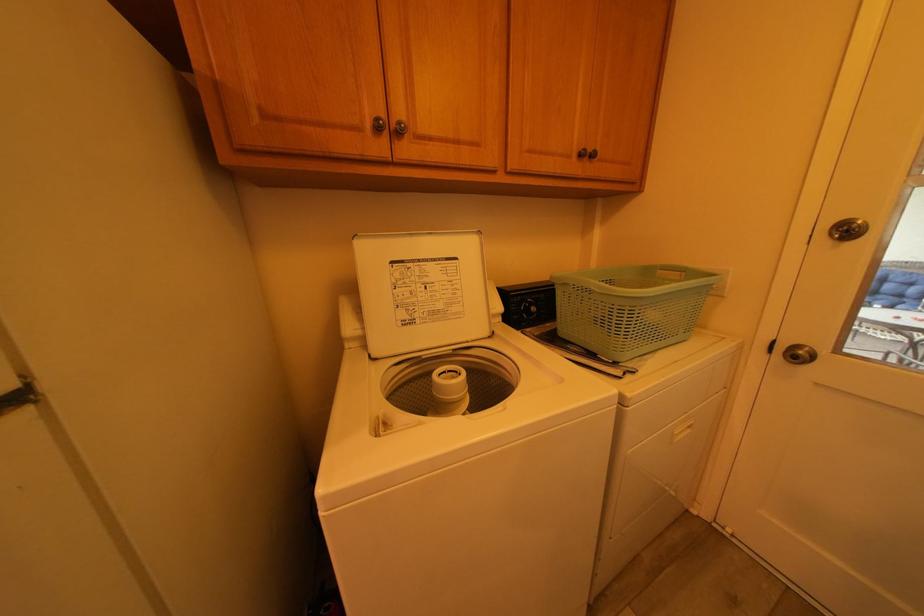
The image size is (924, 616). I want to click on light green basket, so click(629, 307).